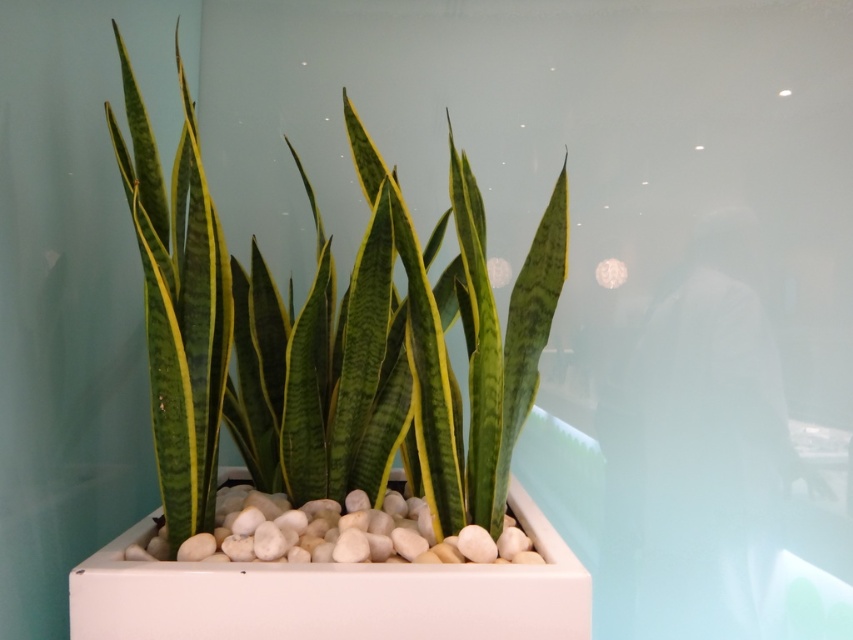
You are arranging a small shelf in your room and have two plants with green glossy leaves at center and green textured leaves at center. If you want to place them side by side, which one should you place on the right to match the image?

The green glossy leaves at center should be placed on the right side of the green textured leaves at center to match the image.

You are an interior designer arranging a modern living room. You have two types of leaves displayed in the scene. Which leaf type, the green glossy leaves at center or the green textured leaves at center, would occupy more space if placed on a small side table?

The green glossy leaves at center is larger in size than the green textured leaves at center, so it would occupy more space on the small side table.

You are an interior designer assessing the potted plant in the scene. You need to determine which leaves are wider between the green glossy leaves at center and the green textured leaves at center. Which ones are wider?

The green glossy leaves at center are wider than the green textured leaves at center.